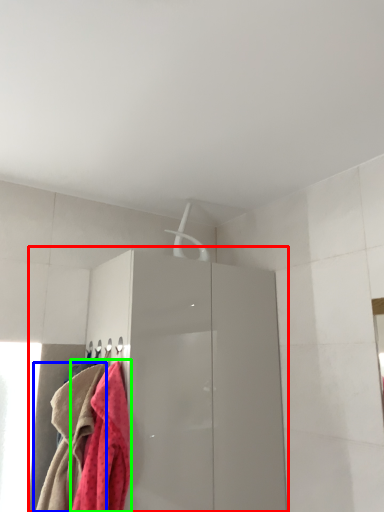
Question: Which is nearer to the dresser (highlighted by a red box)? towel (highlighted by a blue box) or towel (highlighted by a green box).

Choices:
 (A) towel
 (B) towel

Answer: (B)